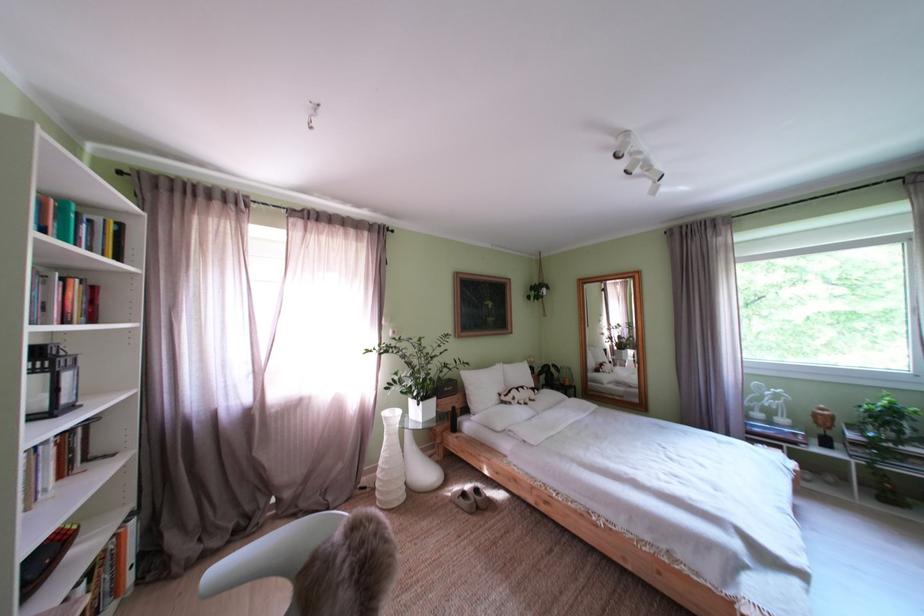
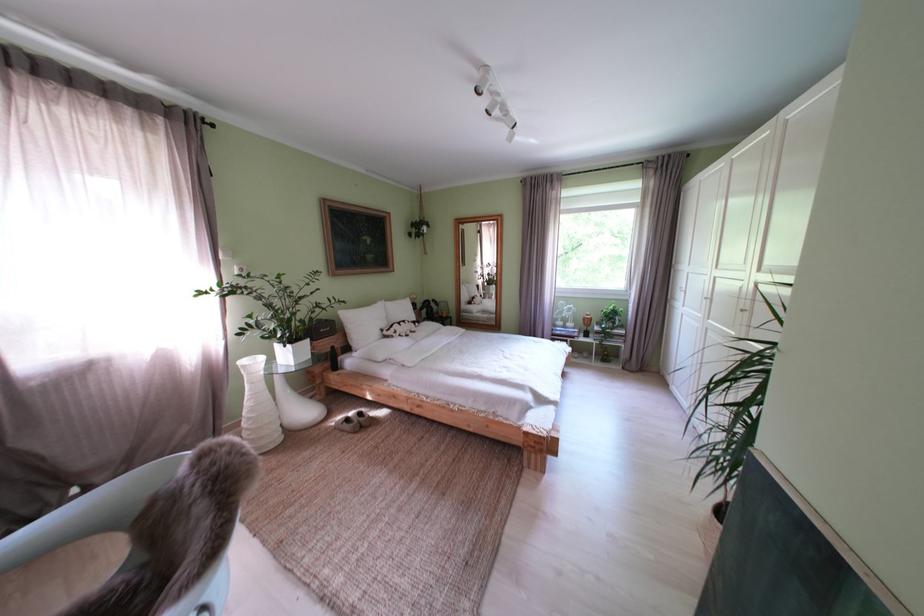
What movement of the cameraman would produce the second image?

The cameraman moved toward right, backward.